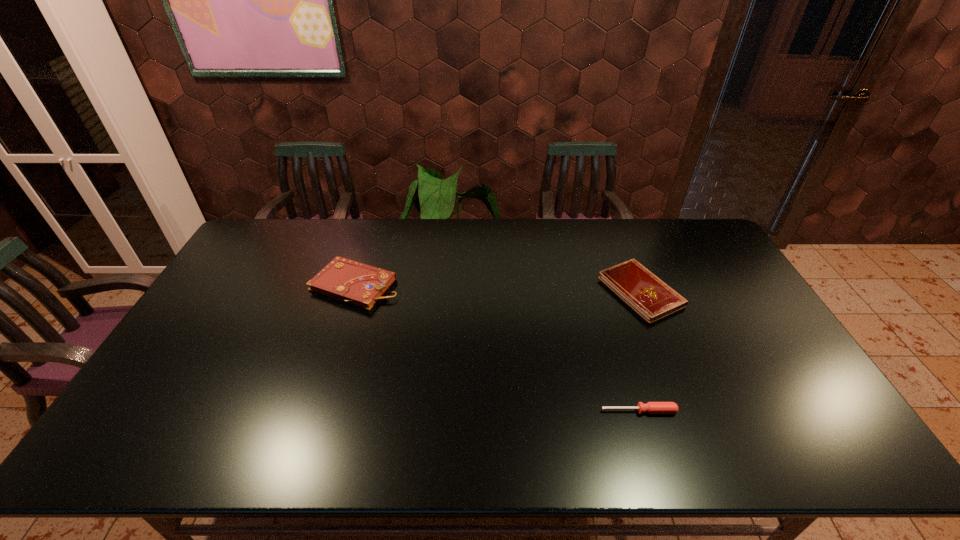
The height and width of the screenshot is (540, 960). In order to click on vacant area at the right edge in this screenshot , I will do `click(746, 372)`.

You are a GUI agent. You are given a task and a screenshot of the screen. Output one action in this format:
    pyautogui.click(x=<x>, y=<y>)
    Task: Click on the free spot between the shorter notebook and the nearest object
    
    Given the screenshot: What is the action you would take?
    pyautogui.click(x=639, y=351)

Where is `vacant space that is in between the left notebook and the screwdriver`? Image resolution: width=960 pixels, height=540 pixels. vacant space that is in between the left notebook and the screwdriver is located at coordinates (497, 348).

Find the location of `vacant space in between the tallest object and the screwdriver`. vacant space in between the tallest object and the screwdriver is located at coordinates (497, 348).

Find the location of a particular element. free spot between the screwdriver and the shorter notebook is located at coordinates (639, 351).

Locate an element on the screen. This screenshot has width=960, height=540. free space between the screwdriver and the shorter notebook is located at coordinates (639, 351).

Find the location of a particular element. The image size is (960, 540). empty location between the screwdriver and the tallest object is located at coordinates (497, 348).

Where is `free area in between the nearest object and the shorter notebook`? This screenshot has width=960, height=540. free area in between the nearest object and the shorter notebook is located at coordinates (639, 351).

The width and height of the screenshot is (960, 540). Find the location of `free space that is in between the tallest object and the nearest object`. free space that is in between the tallest object and the nearest object is located at coordinates (497, 348).

The height and width of the screenshot is (540, 960). In order to click on vacant space in between the nearest object and the shorter notebook in this screenshot , I will do `click(639, 351)`.